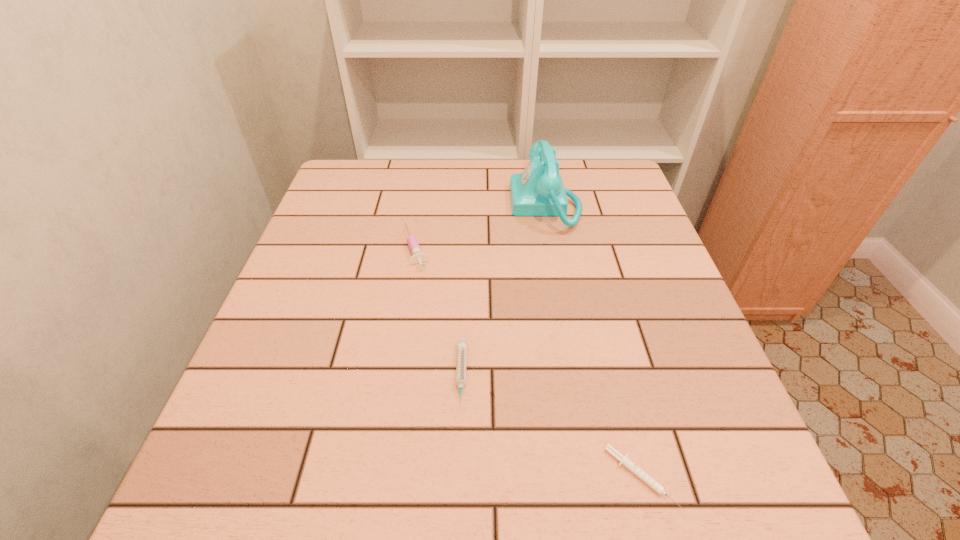
You are a GUI agent. You are given a task and a screenshot of the screen. Output one action in this format:
    pyautogui.click(x=<x>, y=<y>)
    Task: Click on the tallest object
    This screenshot has height=540, width=960.
    Given the screenshot: What is the action you would take?
    pyautogui.click(x=539, y=190)

This screenshot has width=960, height=540. I want to click on the leftmost syringe, so click(417, 257).

Locate an element on the screen. the tallest syringe is located at coordinates (417, 257).

This screenshot has height=540, width=960. In order to click on the second shortest object in this screenshot , I will do `click(462, 344)`.

Identify the location of the second nearest object. The height and width of the screenshot is (540, 960). (462, 344).

Find the location of a particular element. the shortest object is located at coordinates pos(658,488).

You are a GUI agent. You are given a task and a screenshot of the screen. Output one action in this format:
    pyautogui.click(x=<x>, y=<y>)
    Task: Click on the rightmost syringe
    The width and height of the screenshot is (960, 540).
    Given the screenshot: What is the action you would take?
    pyautogui.click(x=658, y=488)

At what (x,y) coordinates should I click in order to perform the action: click on free space located on the dial of the tallest object. Please return your answer as a coordinate pair (x, y). Looking at the image, I should click on (473, 204).

Locate an element on the screen. Image resolution: width=960 pixels, height=540 pixels. vacant area located 0.090m on the dial of the tallest object is located at coordinates (477, 204).

This screenshot has height=540, width=960. What are the coordinates of `free space located 0.200m on the dial of the tallest object` in the screenshot? It's located at (435, 204).